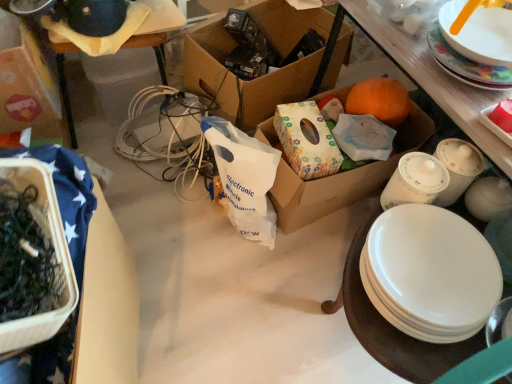
Question: Can cardboard box at center, which is counted as the 4th box, starting from the left, be found inside matte white platter at upper right?

Choices:
 (A) yes
 (B) no

Answer: (B)

Question: Is cardboard box at center, which is counted as the 4th box, starting from the left, at the back of matte white platter at upper right?

Choices:
 (A) no
 (B) yes

Answer: (A)

Question: Is matte white platter at upper right thinner than cardboard box at center, which is counted as the 4th box, starting from the left?

Choices:
 (A) no
 (B) yes

Answer: (B)

Question: Does matte white platter at upper right have a greater width compared to cardboard box at center, arranged as the 1th box when viewed from the right?

Choices:
 (A) no
 (B) yes

Answer: (A)

Question: Considering the relative sizes of matte white platter at upper right and cardboard box at center, which is counted as the 4th box, starting from the left, in the image provided, is matte white platter at upper right smaller than cardboard box at center, which is counted as the 4th box, starting from the left,?

Choices:
 (A) no
 (B) yes

Answer: (B)

Question: In terms of height, does white plastic bag at center look taller or shorter compared to cardboard box at center, which is counted as the 4th box, starting from the left?

Choices:
 (A) tall
 (B) short

Answer: (A)

Question: In the image, is white plastic bag at center positioned in front of or behind cardboard box at center, arranged as the 1th box when viewed from the right?

Choices:
 (A) front
 (B) behind

Answer: (A)

Question: From a real-world perspective, is white plastic bag at center physically located above or below cardboard box at center, arranged as the 1th box when viewed from the right?

Choices:
 (A) above
 (B) below

Answer: (A)

Question: Visually, is white plastic bag at center positioned to the left or to the right of cardboard box at center, which is counted as the 4th box, starting from the left?

Choices:
 (A) left
 (B) right

Answer: (A)

Question: Considering the relative positions of cardboard box at center, which is counted as the 4th box, starting from the left, and white plastic bag at center in the image provided, is cardboard box at center, which is counted as the 4th box, starting from the left, to the left or to the right of white plastic bag at center?

Choices:
 (A) right
 (B) left

Answer: (A)

Question: From the image's perspective, is cardboard box at center, arranged as the 1th box when viewed from the right, located above or below white plastic bag at center?

Choices:
 (A) below
 (B) above

Answer: (B)

Question: Is cardboard box at center, arranged as the 1th box when viewed from the right, wider or thinner than white plastic bag at center?

Choices:
 (A) wide
 (B) thin

Answer: (A)

Question: Relative to white plastic bag at center, is cardboard box at center, arranged as the 1th box when viewed from the right, in front or behind?

Choices:
 (A) front
 (B) behind

Answer: (B)

Question: Is cardboard box at upper left, positioned as the 1th box in left-to-right order, situated inside translucent plastic container at left, arranged as the 2th box when viewed from the left, or outside?

Choices:
 (A) inside
 (B) outside

Answer: (B)

Question: Considering the positions of cardboard box at upper left, placed as the fourth box when sorted from right to left, and translucent plastic container at left, which is the 3th box from right to left, in the image, is cardboard box at upper left, placed as the fourth box when sorted from right to left, taller or shorter than translucent plastic container at left, which is the 3th box from right to left,?

Choices:
 (A) short
 (B) tall

Answer: (B)